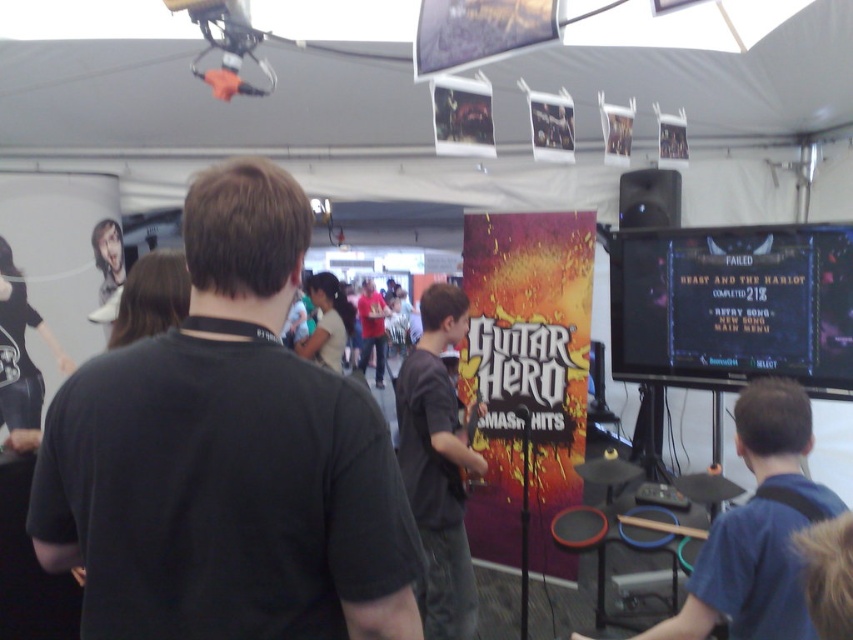
Question: Is orange vibrant poster at center bigger than blue fabric shirt at center?

Choices:
 (A) no
 (B) yes

Answer: (B)

Question: Does black matte t-shirt at center have a smaller size compared to blue fabric shirt at center?

Choices:
 (A) no
 (B) yes

Answer: (B)

Question: Which of the following is the closest to the observer?

Choices:
 (A) (431, 304)
 (B) (570, 323)
 (C) (201, 266)

Answer: (C)

Question: Which point appears closest to the camera in this image?

Choices:
 (A) (209, 484)
 (B) (741, 532)
 (C) (479, 308)

Answer: (A)

Question: Considering the real-world distances, which object is farthest from the blue fabric shirt at center?

Choices:
 (A) dark gray shirt at center
 (B) orange vibrant poster at center
 (C) black matte t-shirt at center

Answer: (B)

Question: Can you confirm if black matte t-shirt at center is smaller than dark gray shirt at center?

Choices:
 (A) yes
 (B) no

Answer: (A)